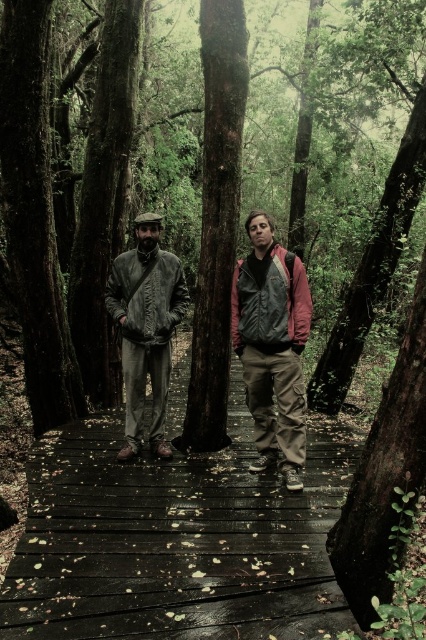
Question: Can you confirm if smooth brown tree trunk at center is positioned above matte black jacket at center?

Choices:
 (A) yes
 (B) no

Answer: (A)

Question: Based on their relative distances, which object is nearer to the distressed leather jacket at center?

Choices:
 (A) dark wood path at center
 (B) matte leather jacket at center
 (C) smooth brown tree trunk at center
 (D) matte black jacket at center

Answer: (D)

Question: Considering the relative positions of smooth brown tree trunk at center and matte leather jacket at center in the image provided, where is smooth brown tree trunk at center located with respect to matte leather jacket at center?

Choices:
 (A) below
 (B) above

Answer: (B)

Question: In this image, where is distressed leather jacket at center located relative to matte black jacket at center?

Choices:
 (A) left
 (B) right

Answer: (A)

Question: Which object appears closest to the camera in this image?

Choices:
 (A) matte leather jacket at center
 (B) smooth brown tree trunk at center

Answer: (B)

Question: Which object appears farthest from the camera in this image?

Choices:
 (A) smooth brown tree trunk at center
 (B) dark wood path at center
 (C) matte black jacket at center
 (D) distressed leather jacket at center

Answer: (A)